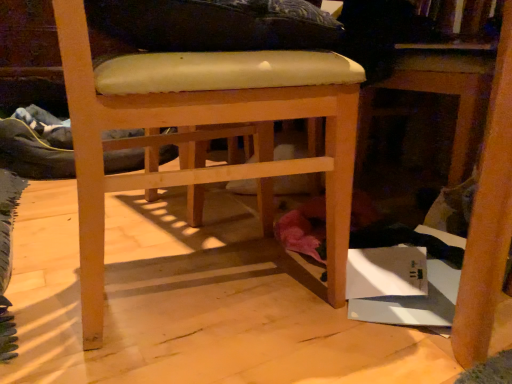
The height and width of the screenshot is (384, 512). What are the coordinates of `free space to the back side of light brown wood chair at center` in the screenshot? It's located at (178, 219).